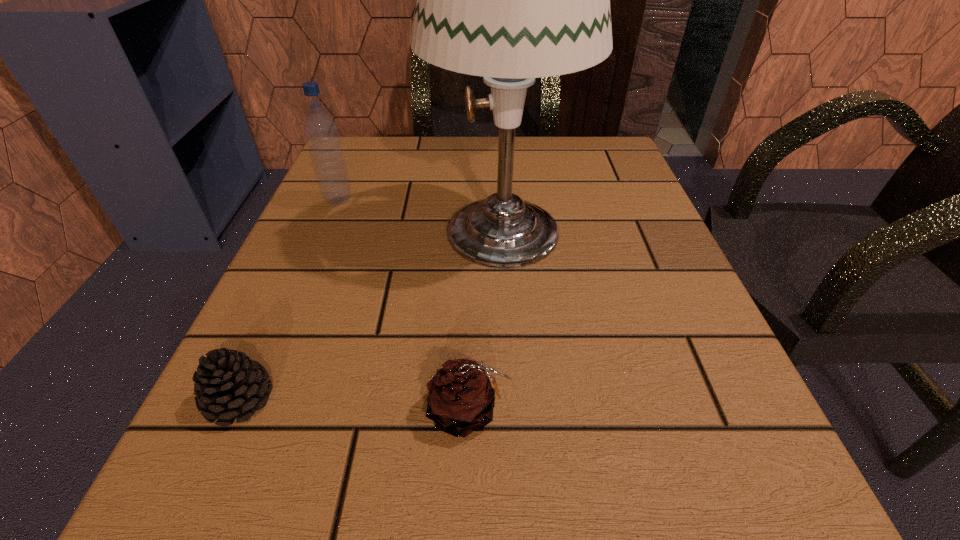
At what (x,y) coordinates should I click in order to perform the action: click on lampshade. Please return your answer as a coordinate pair (x, y). The image size is (960, 540). Looking at the image, I should click on (511, 0).

Find the location of a particular element. This screenshot has width=960, height=540. the third shortest object is located at coordinates (321, 131).

What are the coordinates of `the right pinecone` in the screenshot? It's located at (461, 399).

Where is `the left pinecone`? This screenshot has height=540, width=960. the left pinecone is located at coordinates (228, 385).

What are the coordinates of `free location located 0.070m on the lampshade of the lampshade` in the screenshot? It's located at (389, 230).

You are a GUI agent. You are given a task and a screenshot of the screen. Output one action in this format:
    pyautogui.click(x=<x>, y=<y>)
    Task: Click on the free space located 0.110m on the lampshade of the lampshade
    
    Given the screenshot: What is the action you would take?
    pyautogui.click(x=366, y=230)

Find the location of a particular element. Image resolution: width=960 pixels, height=540 pixels. free location located 0.230m on the lampshade of the lampshade is located at coordinates (298, 230).

The image size is (960, 540). Find the location of `vacant region located on the back of the second tallest object`. vacant region located on the back of the second tallest object is located at coordinates (348, 177).

Image resolution: width=960 pixels, height=540 pixels. What are the coordinates of `vacant area situated with a leaf charm attached to the right pinecone` in the screenshot? It's located at coord(588,411).

Locate an element on the screen. The width and height of the screenshot is (960, 540). vacant space located 0.090m at the narrow end of the left pinecone is located at coordinates (188, 517).